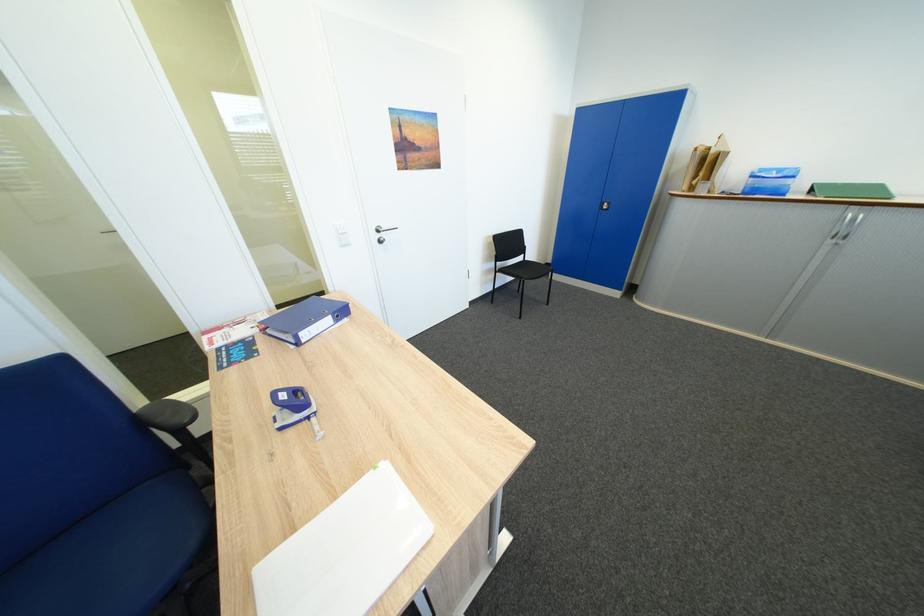
Locate an element on the screen. This screenshot has width=924, height=616. blue chair sitting surface is located at coordinates (113, 554).